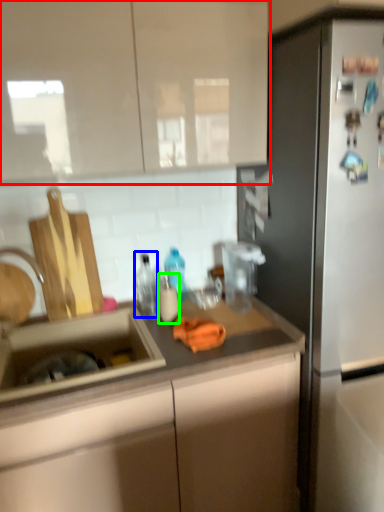
Question: Based on their relative distances, which object is nearer to cabinetry (highlighted by a red box)? Choose from bottle (highlighted by a blue box) and bottle (highlighted by a green box).

Choices:
 (A) bottle
 (B) bottle

Answer: (A)